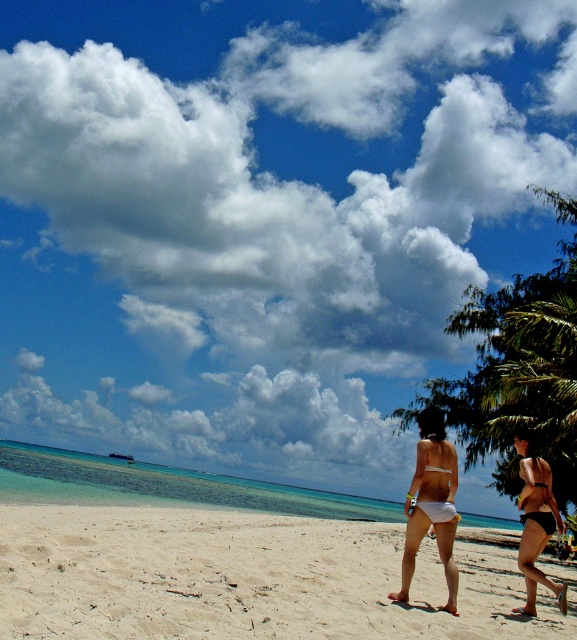
Which is behind, point (167, 563) or point (524, 545)?

Positioned behind is point (167, 563).

Is point (507, 534) behind point (539, 525)?

Yes, it is.

Does point (31, 573) come in front of point (526, 586)?

Yes, point (31, 573) is closer to viewer.

Find the location of `white sandy beach at center`. white sandy beach at center is located at coordinates (252, 577).

Is point (103, 579) positioned after point (415, 540)?

No, it is not.

Between point (9, 596) and point (430, 464), which one is positioned behind?

Positioned behind is point (430, 464).

The width and height of the screenshot is (577, 640). What do you see at coordinates (252, 577) in the screenshot? I see `white sandy beach at center` at bounding box center [252, 577].

Locate an element on the screen. The width and height of the screenshot is (577, 640). white sandy beach at center is located at coordinates (252, 577).

Does white matte bikini bottom at center lie in front of matte black bikini at lower right?

Yes.

Between point (448, 483) and point (535, 614), which one is positioned behind?

Positioned behind is point (535, 614).

Find the location of a particular element. white matte bikini bottom at center is located at coordinates (432, 502).